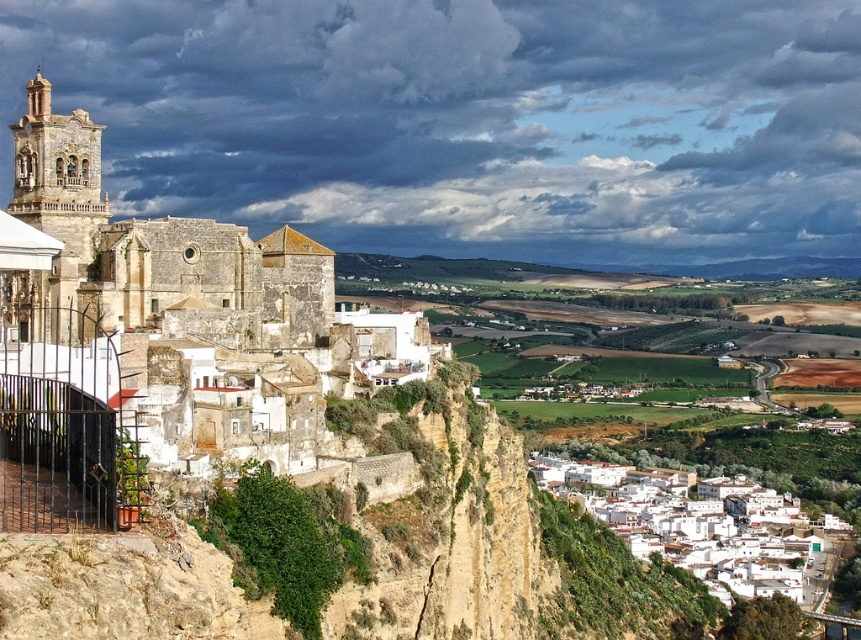
Question: Is white matte buildings at lower right positioned before light beige stone tower at left?

Choices:
 (A) no
 (B) yes

Answer: (A)

Question: Estimate the real-world distances between objects in this image. Which object is closer to the light beige stone tower at left?

Choices:
 (A) stone church at left
 (B) white matte buildings at lower right

Answer: (A)

Question: Observing the image, what is the correct spatial positioning of stone church at left in reference to white matte buildings at lower right?

Choices:
 (A) left
 (B) right

Answer: (A)

Question: Which point is farther to the camera?

Choices:
 (A) (95, 202)
 (B) (150, 401)

Answer: (A)

Question: Is stone church at left below light beige stone tower at left?

Choices:
 (A) yes
 (B) no

Answer: (A)

Question: Estimate the real-world distances between objects in this image. Which object is closer to the white matte buildings at lower right?

Choices:
 (A) stone church at left
 (B) light beige stone tower at left

Answer: (A)